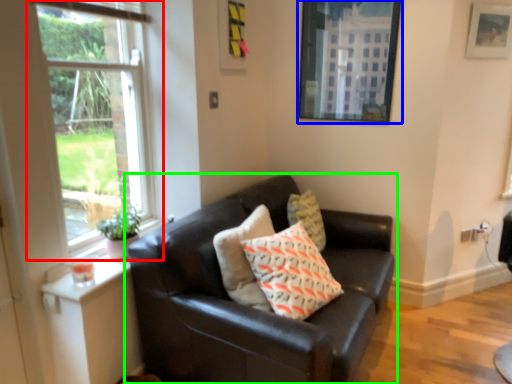
Question: Based on their relative distances, which object is nearer to window (highlighted by a red box)? Choose from picture frame (highlighted by a blue box) and studio couch (highlighted by a green box).

Choices:
 (A) picture frame
 (B) studio couch

Answer: (B)